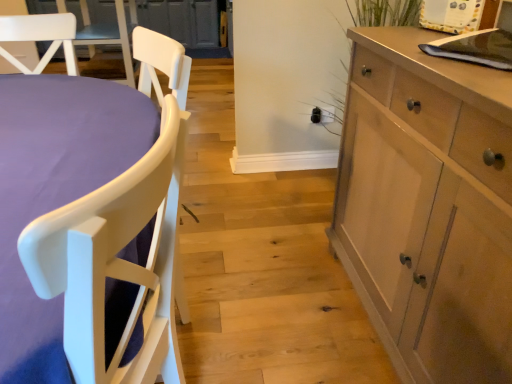
Question: Could light wood cabinet at right be considered to be inside white matte chair at left?

Choices:
 (A) yes
 (B) no

Answer: (B)

Question: Can you confirm if white matte chair at left is thinner than light wood cabinet at right?

Choices:
 (A) yes
 (B) no

Answer: (B)

Question: Is white matte chair at left at the right side of light wood cabinet at right?

Choices:
 (A) yes
 (B) no

Answer: (B)

Question: Is the position of white matte chair at left less distant than that of light wood cabinet at right?

Choices:
 (A) yes
 (B) no

Answer: (A)

Question: Does white matte chair at left have a greater width compared to light wood cabinet at right?

Choices:
 (A) yes
 (B) no

Answer: (A)

Question: Considering the relative sizes of white matte chair at left and light wood cabinet at right in the image provided, is white matte chair at left shorter than light wood cabinet at right?

Choices:
 (A) no
 (B) yes

Answer: (B)

Question: Could you tell me if light wood cabinet at right is turned towards white matte chair at left?

Choices:
 (A) yes
 (B) no

Answer: (A)

Question: Considering the relative sizes of light wood cabinet at right and white matte chair at left in the image provided, is light wood cabinet at right taller than white matte chair at left?

Choices:
 (A) no
 (B) yes

Answer: (B)

Question: Considering the relative sizes of light wood cabinet at right and white matte chair at left in the image provided, is light wood cabinet at right wider than white matte chair at left?

Choices:
 (A) no
 (B) yes

Answer: (A)

Question: Is light wood cabinet at right looking in the opposite direction of white matte chair at left?

Choices:
 (A) yes
 (B) no

Answer: (B)

Question: Is white matte chair at left located within light wood cabinet at right?

Choices:
 (A) yes
 (B) no

Answer: (B)

Question: Are light wood cabinet at right and white matte chair at left located far from each other?

Choices:
 (A) yes
 (B) no

Answer: (B)

Question: In terms of size, does white matte chair at left appear bigger or smaller than light wood cabinet at right?

Choices:
 (A) small
 (B) big

Answer: (B)